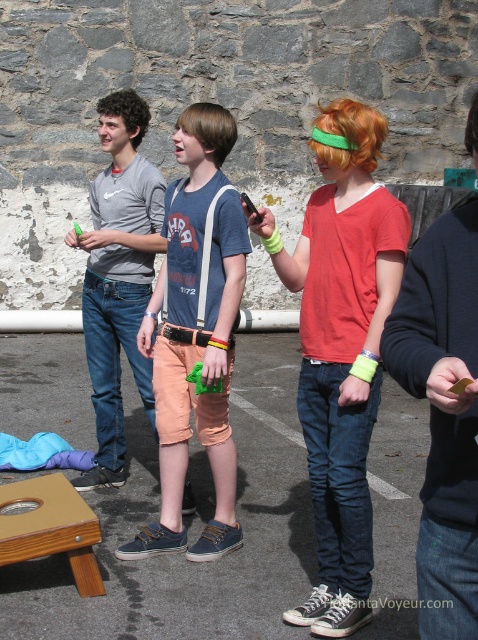
You are standing in the parking lot and see a red tshirt at center. There is a point at coordinates (340, 348). Is that point on the red tshirt?

Yes, the point at (340, 348) is on the matte red tshirt at center.